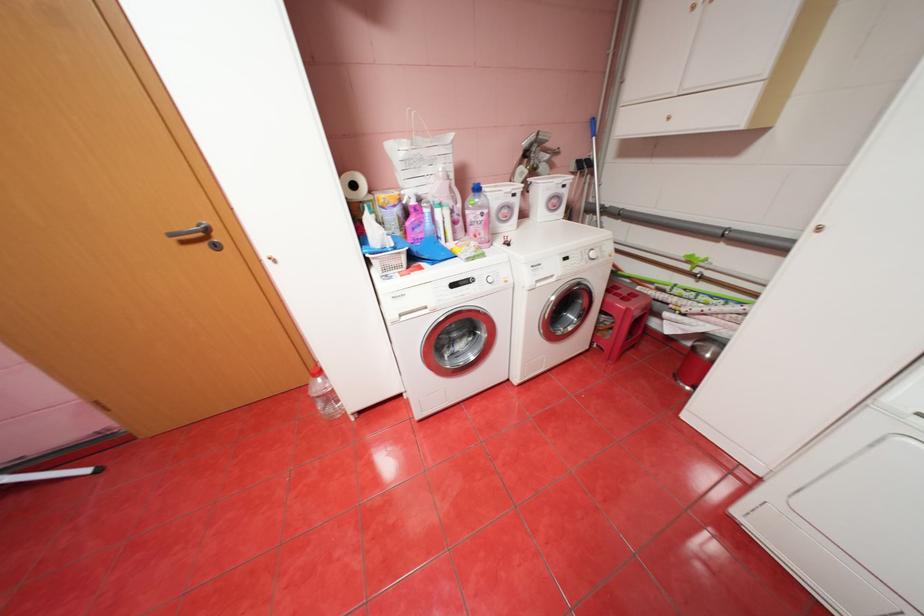
Locate an element on the screen. The width and height of the screenshot is (924, 616). washing machine dial is located at coordinates (599, 253).